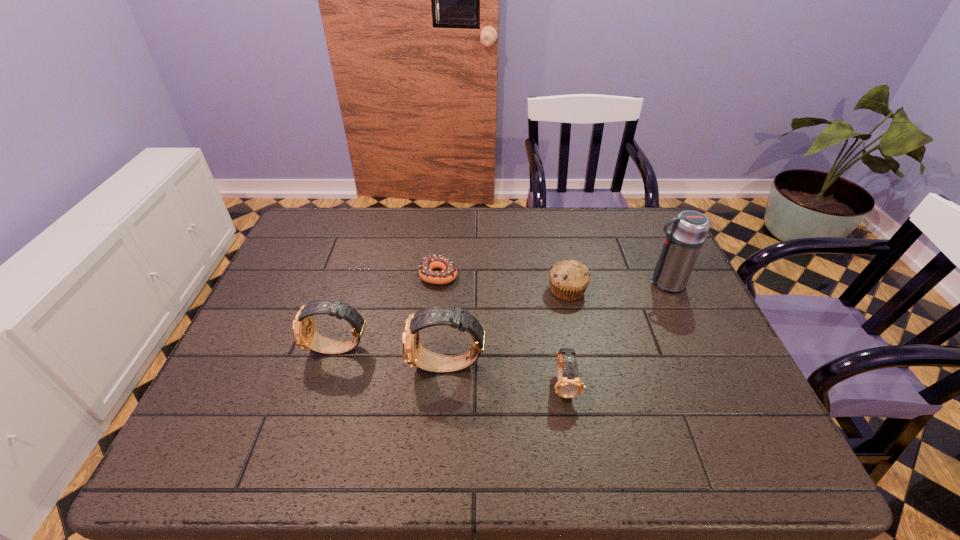
I want to click on vacant space located on the face of the leftmost object, so click(237, 349).

The height and width of the screenshot is (540, 960). Find the location of `blank area located on the face of the second watch from right to left`. blank area located on the face of the second watch from right to left is located at coordinates (247, 367).

Locate an element on the screen. vacant position located on the face of the second watch from right to left is located at coordinates (363, 367).

At what (x,y) coordinates should I click in order to perform the action: click on free space located on the face of the second watch from right to left. Please return your answer as a coordinate pair (x, y). Looking at the image, I should click on (264, 367).

What are the coordinates of `free spot located 0.310m with a handle on the side of the thermos bottle` in the screenshot? It's located at (536, 283).

The image size is (960, 540). In order to click on blank space located with a handle on the side of the thermos bottle in this screenshot , I will do `click(504, 283)`.

Image resolution: width=960 pixels, height=540 pixels. What are the coordinates of `vacant space located 0.350m with a handle on the side of the thermos bottle` in the screenshot? It's located at (522, 283).

Locate an element on the screen. The height and width of the screenshot is (540, 960). blank space located on the back of the doughnut is located at coordinates (444, 227).

At what (x,y) coordinates should I click in order to perform the action: click on free space located on the left of the muffin. Please return your answer as a coordinate pair (x, y). Image resolution: width=960 pixels, height=540 pixels. Looking at the image, I should click on (529, 291).

What are the coordinates of `object that is at the right edge` in the screenshot? It's located at (682, 245).